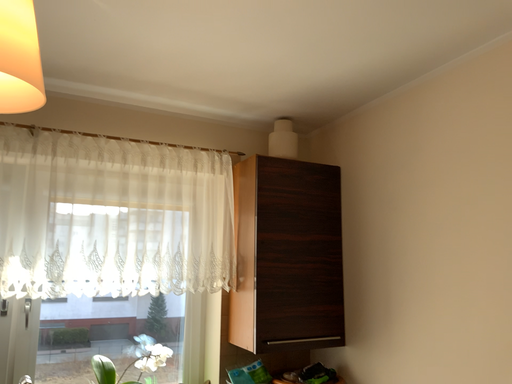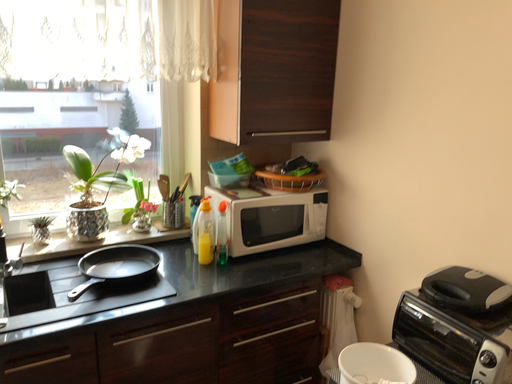
Question: Which way did the camera rotate in the video?

Choices:
 (A) rotated downward
 (B) rotated upward

Answer: (A)